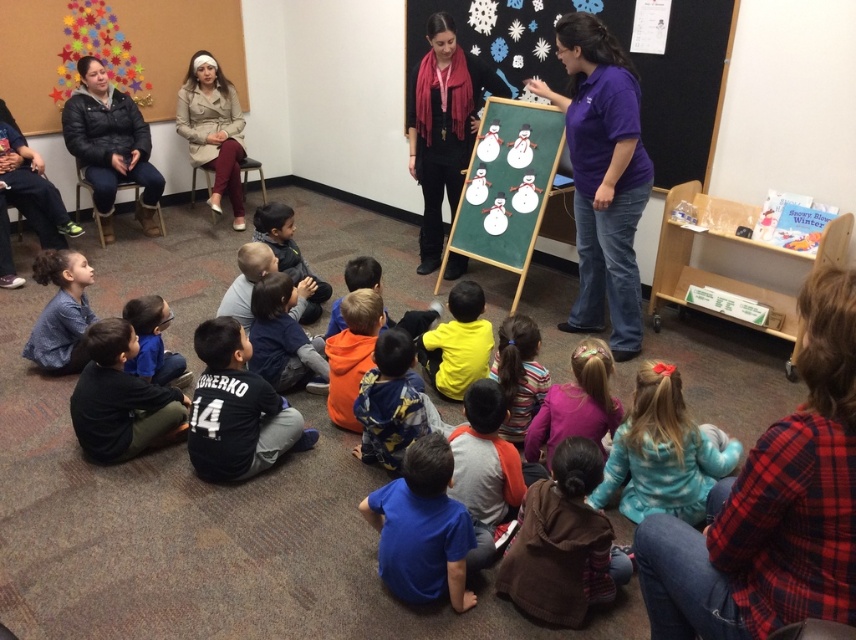
You are a teacher in the classroom and want to hand out a worksheet to both the child wearing the purple cotton shirt at center and the child wearing the orange fleece jacket at center. If your arm can reach 4 feet, can you reach both children without moving?

The purple cotton shirt at center and orange fleece jacket at center are 4.42 feet apart from each other. Since the distance between them is greater than your 4 feet reach, you cannot reach both children without moving.

In the classroom scene, there are children sitting on the floor and two educators. You notice a point marked at coordinates (519, 374). Based on the scene description, what object or clothing item is this point located on?

The point at coordinates (519, 374) is located on the striped fabric shirt at center.